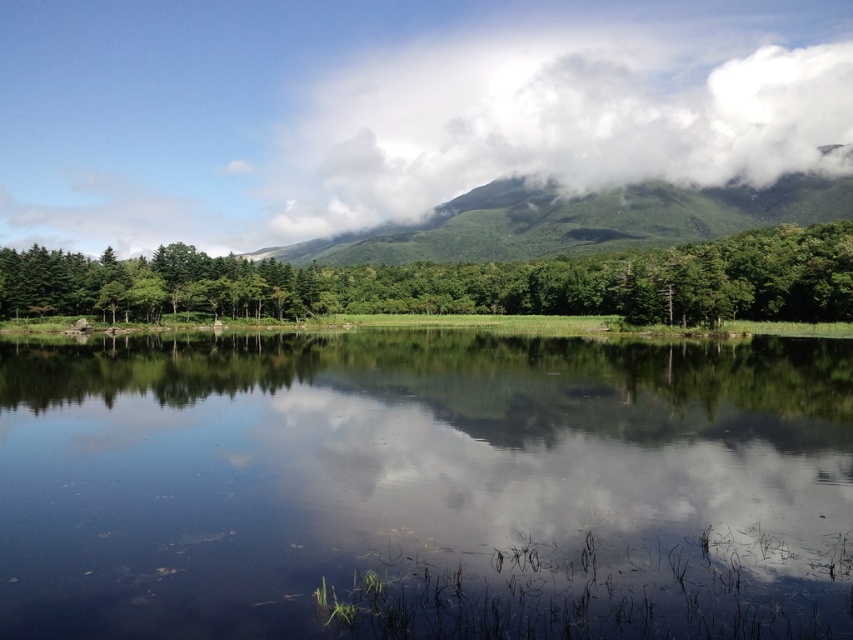
Question: Which point is farther from the camera taking this photo?

Choices:
 (A) (553, 225)
 (B) (839, 244)
 (C) (163, 413)
 (D) (656, 72)

Answer: (D)

Question: Does white fluffy cloud at upper center have a greater width compared to green leafy tree at center?

Choices:
 (A) yes
 (B) no

Answer: (A)

Question: Estimate the real-world distances between objects in this image. Which object is closer to the green leafy tree at center?

Choices:
 (A) green leafy mountain at upper center
 (B) white fluffy cloud at upper center
 (C) transparent water at center

Answer: (C)

Question: Where is white fluffy cloud at upper center located in relation to green leafy mountain at upper center in the image?

Choices:
 (A) right
 (B) left

Answer: (A)

Question: Is transparent water at center further to camera compared to green leafy tree at center?

Choices:
 (A) no
 (B) yes

Answer: (A)

Question: Among these objects, which one is farthest from the camera?

Choices:
 (A) transparent water at center
 (B) white fluffy cloud at upper center

Answer: (B)